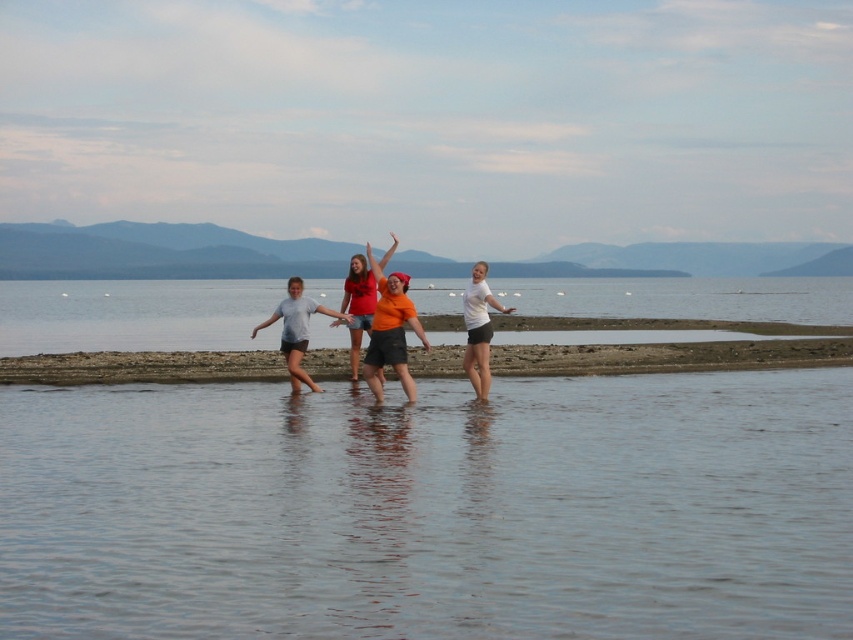
Question: Can you confirm if orange matte shirt at center is bigger than white matte t-shirt at center?

Choices:
 (A) yes
 (B) no

Answer: (A)

Question: Does clear water at lower center lie in front of matte gray shorts at center?

Choices:
 (A) no
 (B) yes

Answer: (B)

Question: From the image, what is the correct spatial relationship of clear water at lower center in relation to matte gray shorts at center?

Choices:
 (A) right
 (B) left

Answer: (A)

Question: Which of the following is the farthest from the observer?

Choices:
 (A) (509, 307)
 (B) (299, 374)

Answer: (A)

Question: Estimate the real-world distances between objects in this image. Which object is farther from the orange matte shirt at center?

Choices:
 (A) white matte t-shirt at center
 (B) matte gray shorts at center
 (C) clear water at lower center

Answer: (C)

Question: Which point is farther to the camera?

Choices:
 (A) (381, 324)
 (B) (299, 337)
 (C) (473, 336)
 (D) (790, 538)

Answer: (B)